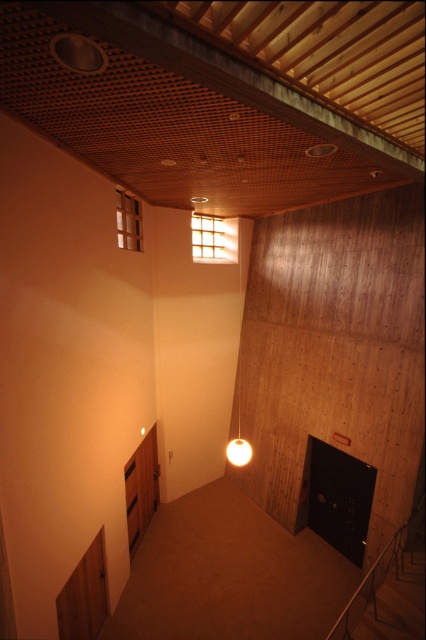
Does point (213, 259) come closer to viewer compared to point (132, 241)?

No, (213, 259) is behind (132, 241).

Which is more to the right, translucent wooden window at upper center or clear glass window at upper center?

translucent wooden window at upper center is more to the right.

Who is more forward, (x=192, y=240) or (x=135, y=218)?

Point (x=135, y=218) is more forward.

You are a GUI agent. You are given a task and a screenshot of the screen. Output one action in this format:
    pyautogui.click(x=<x>, y=<y>)
    Task: Click on the translucent wooden window at upper center
    The image size is (426, 640).
    Given the screenshot: What is the action you would take?
    pyautogui.click(x=213, y=237)

Is brown wooden rail at lower right further to camera compared to clear glass window at upper center?

No, brown wooden rail at lower right is closer to the viewer.

Does point (370, 604) lie behind point (126, 216)?

No.

I want to click on brown wooden rail at lower right, so click(371, 586).

Identify the location of brown wooden rail at lower right. The width and height of the screenshot is (426, 640). (371, 586).

Between clear glass window at upper center and matte white lampshade at center, which one is positioned lower?

matte white lampshade at center is below.

Can you confirm if clear glass window at upper center is shorter than matte white lampshade at center?

In fact, clear glass window at upper center may be taller than matte white lampshade at center.

Which is in front, point (126, 241) or point (239, 445)?

Point (239, 445)

The width and height of the screenshot is (426, 640). I want to click on clear glass window at upper center, so click(x=129, y=221).